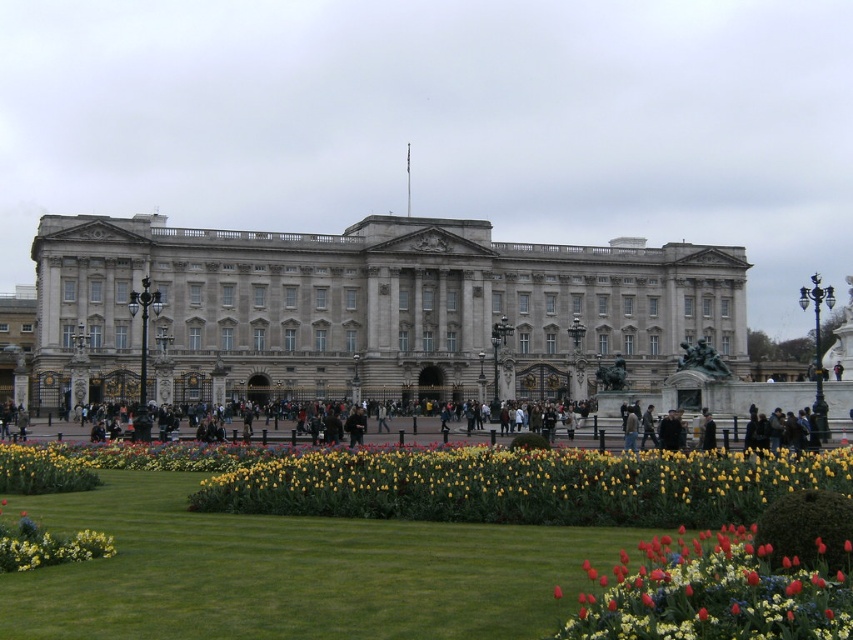
In the scene shown: Can you confirm if white stone building at center is wider than yellow-green grass at center?

Yes, white stone building at center is wider than yellow-green grass at center.

Which of these two, white stone building at center or yellow-green grass at center, stands taller?

white stone building at center is taller.

The image size is (853, 640). Find the location of `white stone building at center`. white stone building at center is located at coordinates (370, 308).

The image size is (853, 640). Identify the location of white stone building at center. (370, 308).

Does yellow-green grass at center have a greater width compared to yellow matte flower at lower center?

No.

Is yellow-green grass at center below yellow matte flower at lower center?

Yes, yellow-green grass at center is below yellow matte flower at lower center.

This screenshot has height=640, width=853. I want to click on yellow-green grass at center, so click(x=286, y=572).

Between yellow matte flower at lower center and vivid red tulip at lower right, which one is positioned lower?

vivid red tulip at lower right is lower down.

Between point (737, 461) and point (590, 568), which one is positioned in front?

Point (590, 568) is more forward.

Where is `yellow matte flower at lower center`? yellow matte flower at lower center is located at coordinates (477, 474).

Locate an element on the screen. This screenshot has width=853, height=640. yellow matte flower at lower center is located at coordinates (477, 474).